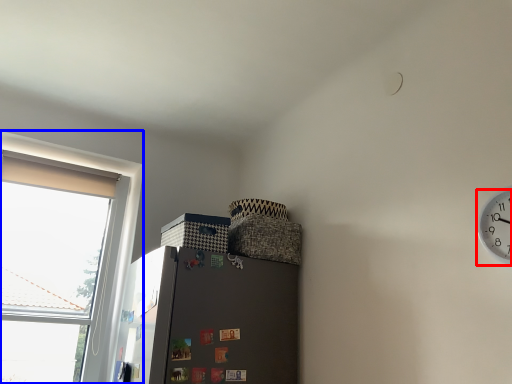
Question: Which object appears farthest to the camera in this image, clock (highlighted by a red box) or window (highlighted by a blue box)?

Choices:
 (A) clock
 (B) window

Answer: (B)